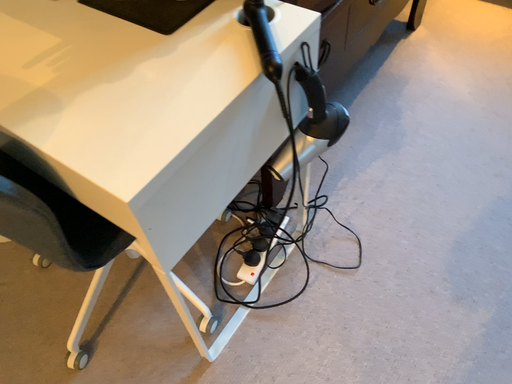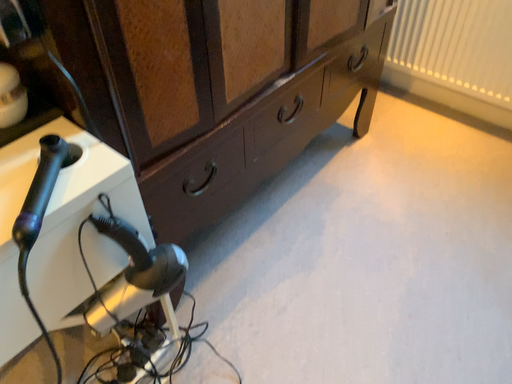
Question: Which way did the camera rotate in the video?

Choices:
 (A) rotated downward
 (B) rotated upward

Answer: (B)